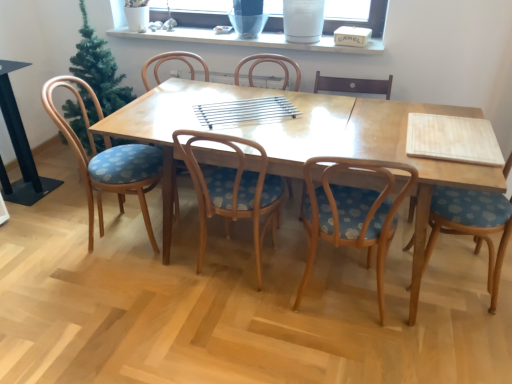
Identify the location of vacant area that lies between wooden chair with floral cushion at center, the 3th chair in the right-to-left sequence, and wooden chair with blue cushion at center, which is counted as the 4th chair, starting from the right. (249, 244).